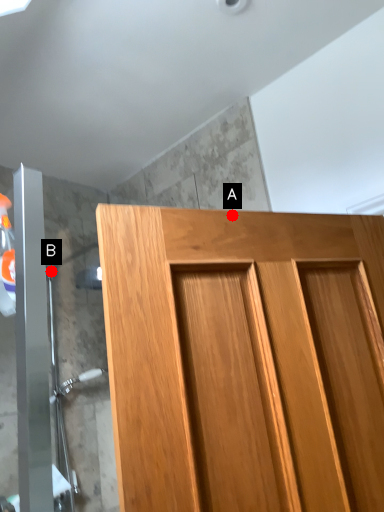
Question: Two points are circled on the image, labeled by A and B beside each circle. Which of the following is the closest to the observer?

Choices:
 (A) A is closer
 (B) B is closer

Answer: (B)